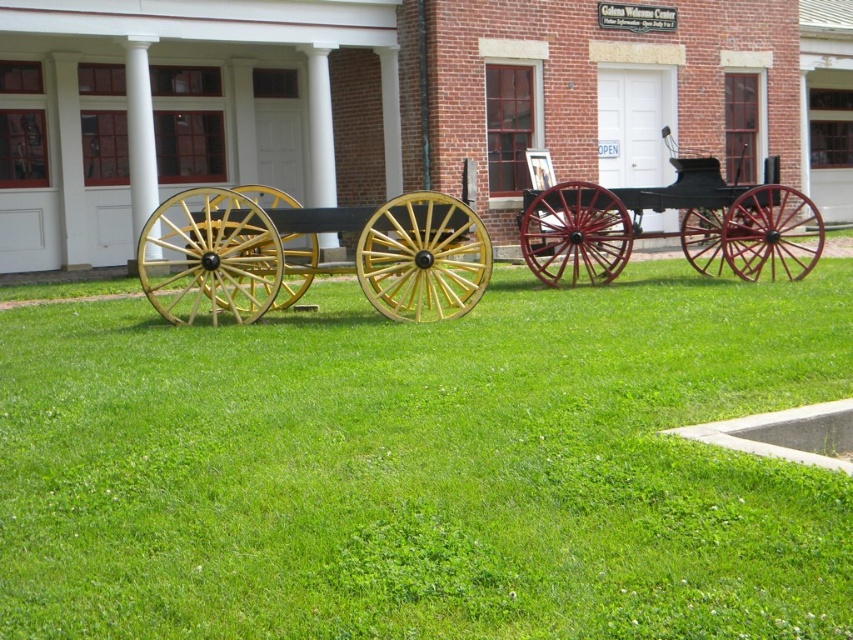
Who is positioned more to the left, green grass at center or wooden wagon wheels at center?

wooden wagon wheels at center is more to the left.

Between point (244, 500) and point (210, 292), which one is positioned in front?

Point (244, 500)

Where is `green grass at center`? Image resolution: width=853 pixels, height=640 pixels. green grass at center is located at coordinates (426, 467).

Is wooden wagon wheels at center taller than polished wood cart at center?

Yes, wooden wagon wheels at center is taller than polished wood cart at center.

Does wooden wagon wheels at center lie in front of polished wood cart at center?

Yes, wooden wagon wheels at center is in front of polished wood cart at center.

Is point (248, 259) in front of point (728, 224)?

Yes, point (248, 259) is in front of point (728, 224).

The image size is (853, 640). What are the coordinates of `wooden wagon wheels at center` in the screenshot? It's located at (308, 262).

Which of these two, green grass at center or polished wood cart at center, stands taller?

polished wood cart at center

How far apart are green grass at center and polished wood cart at center?

They are 8.73 meters apart.

Between point (567, 477) and point (544, 220), which one is positioned behind?

Point (544, 220)

You are a GUI agent. You are given a task and a screenshot of the screen. Output one action in this format:
    pyautogui.click(x=<x>, y=<y>)
    Task: Click on the green grass at center
    This screenshot has height=640, width=853.
    Given the screenshot: What is the action you would take?
    pyautogui.click(x=426, y=467)